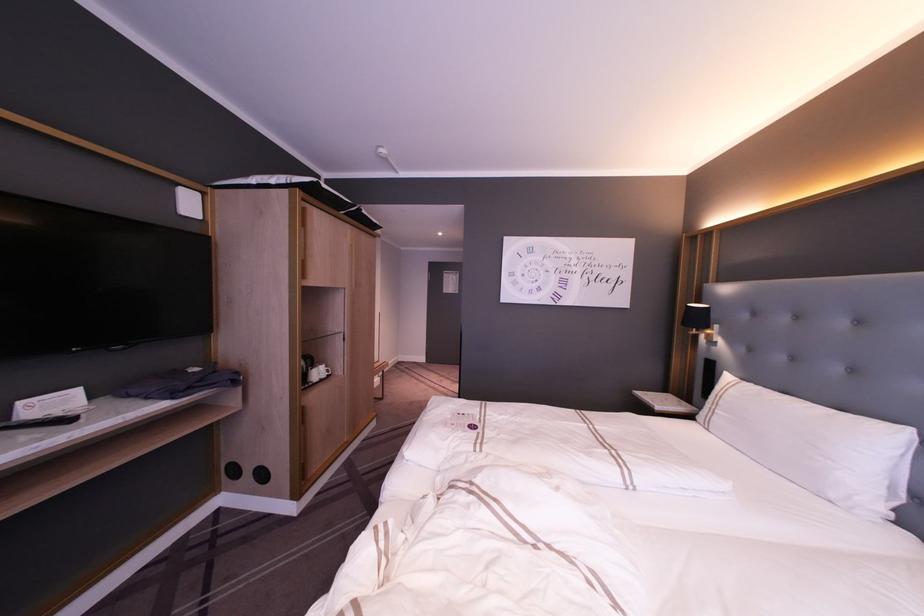
Find where to adjust the black lamp head. Please return your answer as a coordinate pair (x, y).

(699, 321)